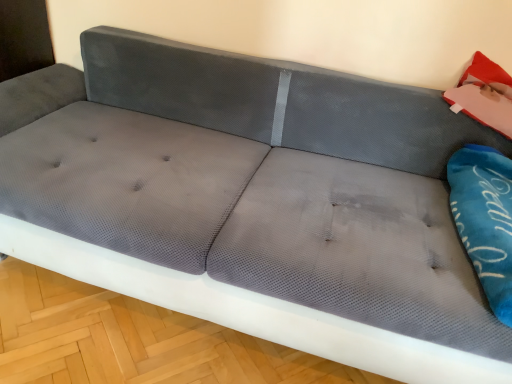
Question: From a real-world perspective, is matte pink cushion at upper right physically located above or below blue fabric pillow at right?

Choices:
 (A) below
 (B) above

Answer: (B)

Question: Considering the relative positions of matte pink cushion at upper right and blue fabric pillow at right in the image provided, is matte pink cushion at upper right to the left or to the right of blue fabric pillow at right?

Choices:
 (A) right
 (B) left

Answer: (A)

Question: Considering their positions, is matte pink cushion at upper right located in front of or behind blue fabric pillow at right?

Choices:
 (A) front
 (B) behind

Answer: (B)

Question: In terms of size, does blue fabric pillow at right appear bigger or smaller than matte pink cushion at upper right?

Choices:
 (A) small
 (B) big

Answer: (B)

Question: Is blue fabric pillow at right taller or shorter than matte pink cushion at upper right?

Choices:
 (A) tall
 (B) short

Answer: (B)

Question: Considering their positions, is blue fabric pillow at right located in front of or behind matte pink cushion at upper right?

Choices:
 (A) behind
 (B) front

Answer: (B)

Question: Is point (475, 173) positioned closer to the camera than point (481, 66)?

Choices:
 (A) closer
 (B) farther

Answer: (A)